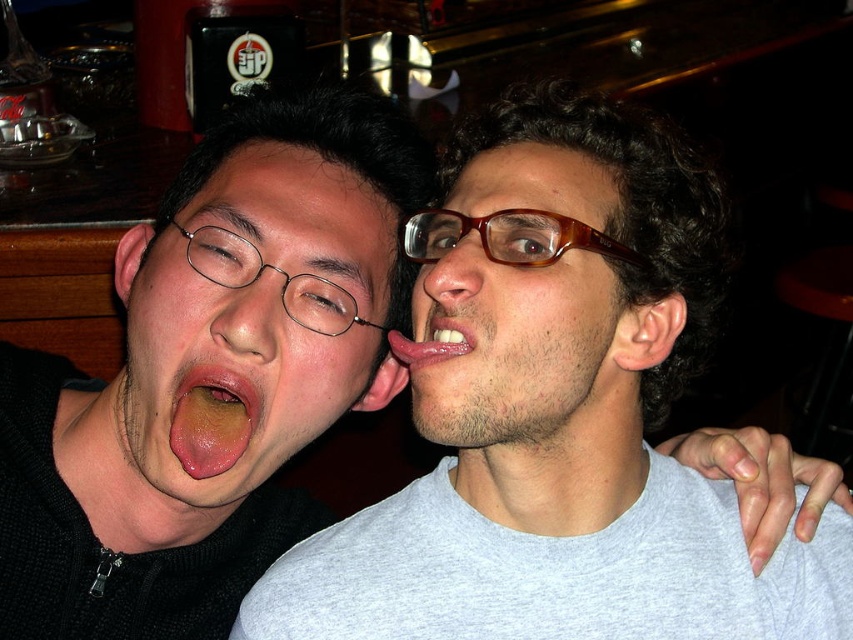
Question: Based on their relative distances, which object is nearer to the smooth skin nose at center?

Choices:
 (A) pink glossy tongue at center
 (B) matte skin nose at center

Answer: (A)

Question: Is brown glossy glasses at center smaller than yellowish-green tongue at center?

Choices:
 (A) yes
 (B) no

Answer: (B)

Question: Which of the following is the closest to the observer?

Choices:
 (A) (235, 349)
 (B) (508, 428)
 (C) (264, 410)
 (D) (440, 316)

Answer: (D)

Question: Which point appears farthest from the camera in this image?

Choices:
 (A) (457, 336)
 (B) (273, 426)
 (C) (585, 212)
 (D) (276, 273)

Answer: (B)

Question: Can you confirm if matte skin nose at center is positioned above pink glossy tongue at center?

Choices:
 (A) yes
 (B) no

Answer: (A)

Question: Is matte skin nose at center positioned in front of smooth skin nose at center?

Choices:
 (A) no
 (B) yes

Answer: (A)